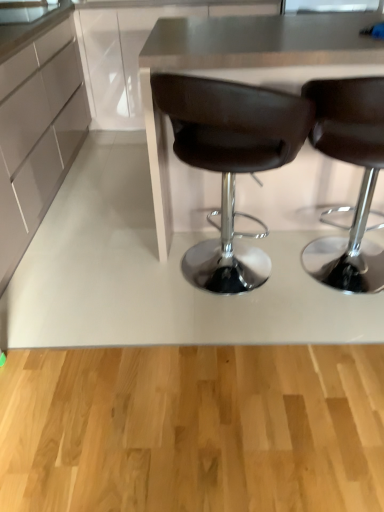
Question: Which direction should I rotate to face brown leather chair at center, placed as the 2th chair when sorted from left to right, — up or down?

Choices:
 (A) up
 (B) down

Answer: (A)

Question: Is brown leather chair at center, placed as the 2th chair when sorted from left to right, directly adjacent to matte white cabinet at left?

Choices:
 (A) no
 (B) yes

Answer: (A)

Question: Is brown leather chair at center, placed as the 2th chair when sorted from left to right, not near matte white cabinet at left?

Choices:
 (A) no
 (B) yes

Answer: (B)

Question: Does brown leather chair at center, which is the 1th chair from right to left, have a lesser width compared to matte white cabinet at left?

Choices:
 (A) yes
 (B) no

Answer: (A)

Question: From a real-world perspective, is brown leather chair at center, which is the 1th chair from right to left, physically above matte white cabinet at left?

Choices:
 (A) no
 (B) yes

Answer: (A)

Question: From the image's perspective, does brown leather chair at center, which is the 1th chair from right to left, appear higher than matte white cabinet at left?

Choices:
 (A) no
 (B) yes

Answer: (A)

Question: Is brown leather chair at center, placed as the 2th chair when sorted from left to right, aimed at matte white cabinet at left?

Choices:
 (A) yes
 (B) no

Answer: (B)

Question: Is the depth of metallic gray table at center less than that of matte white cabinet at left?

Choices:
 (A) no
 (B) yes

Answer: (B)

Question: Does metallic gray table at center have a larger size compared to matte white cabinet at left?

Choices:
 (A) no
 (B) yes

Answer: (B)

Question: Is metallic gray table at center taller than matte white cabinet at left?

Choices:
 (A) no
 (B) yes

Answer: (B)

Question: From a real-world perspective, does metallic gray table at center stand above matte white cabinet at left?

Choices:
 (A) no
 (B) yes

Answer: (A)

Question: Is metallic gray table at center behind matte white cabinet at left?

Choices:
 (A) no
 (B) yes

Answer: (A)

Question: Is metallic gray table at center positioned with its back to matte white cabinet at left?

Choices:
 (A) yes
 (B) no

Answer: (B)

Question: Is matte white cabinet at left closer to camera compared to brown leather chair at center, placed as the first chair when sorted from left to right?

Choices:
 (A) no
 (B) yes

Answer: (A)